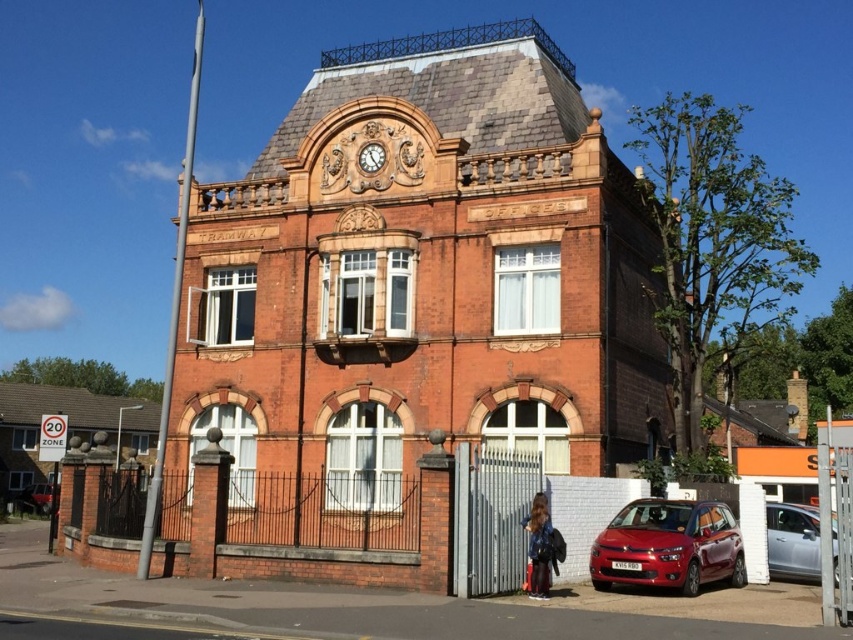
Question: Does satin silver car at lower right appear over dark brown leather jacket at lower right?

Choices:
 (A) no
 (B) yes

Answer: (A)

Question: Is glossy metallic car at lower right above satin silver car at lower right?

Choices:
 (A) no
 (B) yes

Answer: (A)

Question: Among these points, which one is nearest to the camera?

Choices:
 (A) (730, 570)
 (B) (538, 541)
 (C) (834, 560)
 (D) (48, 506)

Answer: (C)

Question: Does dark brown leather jacket at lower right appear on the right side of metallic red car at lower left?

Choices:
 (A) yes
 (B) no

Answer: (A)

Question: Estimate the real-world distances between objects in this image. Which object is farther from the glossy metallic car at lower right?

Choices:
 (A) satin silver car at lower right
 (B) gold textured clock at upper center

Answer: (B)

Question: Based on their relative distances, which object is farther from the dark brown leather jacket at lower right?

Choices:
 (A) metallic red car at lower left
 (B) glossy metallic car at lower right
 (C) satin silver car at lower right
 (D) gold textured clock at upper center

Answer: (A)